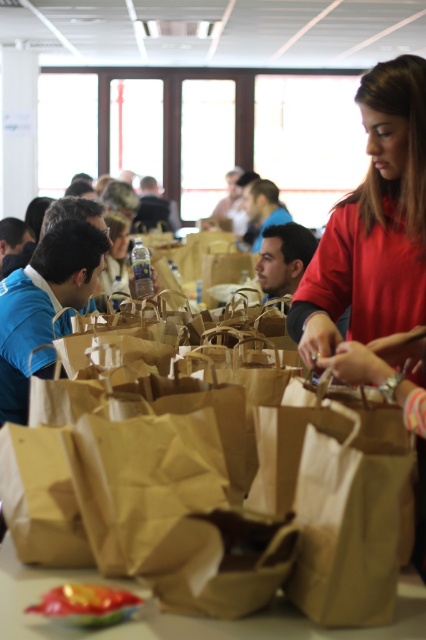
Who is shorter, brown paper bag at lower center or shiny plastic bowl at center?

Standing shorter between the two is shiny plastic bowl at center.

Is brown paper bag at lower center closer to the viewer compared to shiny plastic bowl at center?

Yes, brown paper bag at lower center is closer to the viewer.

The image size is (426, 640). Find the location of `brown paper bag at lower center`. brown paper bag at lower center is located at coordinates (184, 616).

Is brown paper bag at lower center smaller than blue fabric shirt at left?

Indeed, brown paper bag at lower center has a smaller size compared to blue fabric shirt at left.

Does brown paper bag at lower center have a greater height compared to blue fabric shirt at left?

No, brown paper bag at lower center is not taller than blue fabric shirt at left.

Does point (209, 625) come closer to viewer compared to point (49, 241)?

Yes, point (209, 625) is closer to viewer.

This screenshot has width=426, height=640. I want to click on brown paper bag at lower center, so click(x=184, y=616).

Which is in front, point (31, 317) or point (74, 605)?

Point (74, 605) is more forward.

Identify the location of blue fabric shirt at left. (43, 307).